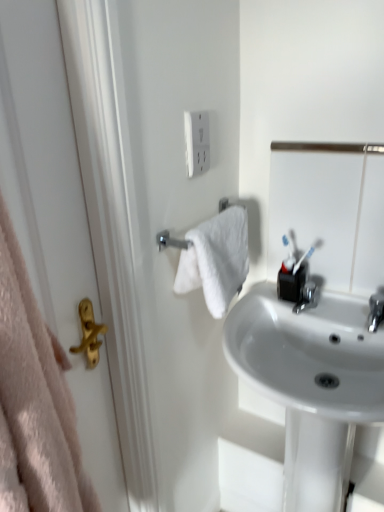
Question: Would you say white glossy sink at center is inside or outside metallic silver mirror at upper right?

Choices:
 (A) inside
 (B) outside

Answer: (B)

Question: Does point [360, 414] appear closer or farther from the camera than point [319, 218]?

Choices:
 (A) closer
 (B) farther

Answer: (A)

Question: Considering the real-world distances, which object is closest to the silver metallic towel rack at center-left?

Choices:
 (A) white glossy sink at center
 (B) white plastic outlet at upper center
 (C) metallic silver mirror at upper right
 (D) matte gold handle at left

Answer: (B)

Question: Which object is positioned farthest from the metallic silver mirror at upper right?

Choices:
 (A) white plastic outlet at upper center
 (B) matte gold handle at left
 (C) white glossy sink at center
 (D) silver metallic towel rack at center-left

Answer: (B)